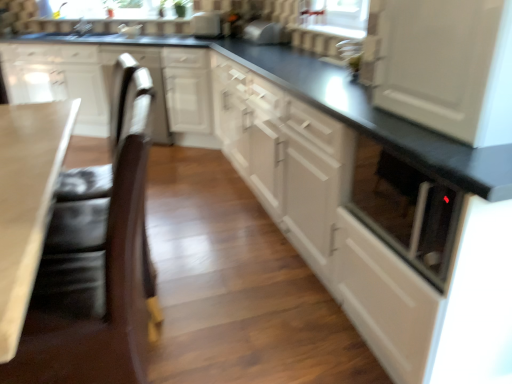
Question: Considering the positions of point (182, 125) and point (51, 165), is point (182, 125) closer or farther from the camera than point (51, 165)?

Choices:
 (A) closer
 (B) farther

Answer: (B)

Question: Is white glossy cabinet at center, the fourth cabinetry from the left, bigger or smaller than smooth beige countertop at lower left?

Choices:
 (A) big
 (B) small

Answer: (B)

Question: Estimate the real-world distances between objects in this image. Which object is farther from the matte white vase at upper center?

Choices:
 (A) smooth beige countertop at lower left
 (B) satin silver toaster at upper center, placed as the 2th appliance when sorted from back to front
 (C) white glossy cabinet at center, which is the second cabinetry in right-to-left order
 (D) white glossy cabinet at center, the first cabinetry in the right-to-left sequence
 (E) white glossy cabinet at upper left, acting as the 2th cabinetry starting from the left

Answer: (A)

Question: Which object is the closest to the white glossy toaster at upper center, placed as the first appliance when sorted from left to right?

Choices:
 (A) white glossy cabinet at left, which ranks as the 1th cabinetry in left-to-right order
 (B) smooth beige countertop at lower left
 (C) matte white vase at upper center
 (D) white glossy cabinet at upper left, marked as the third cabinetry in a right-to-left arrangement
 (E) white glossy cabinet at center, the first cabinetry in the right-to-left sequence

Answer: (C)